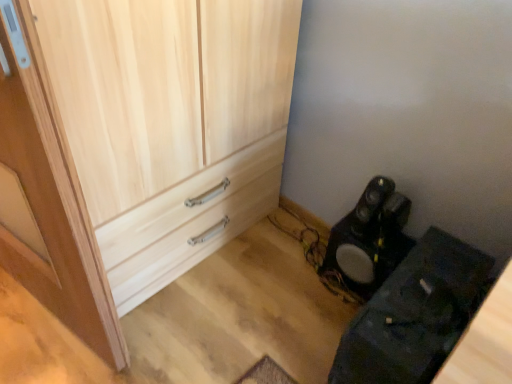
Locate an element on the screen. free space in front of wooden door at left is located at coordinates (38, 347).